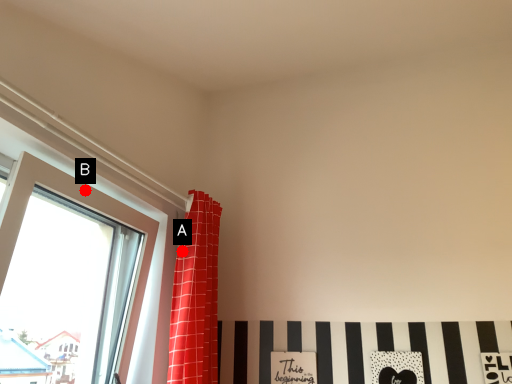
Question: Two points are circled on the image, labeled by A and B beside each circle. Which point is farther from the camera taking this photo?

Choices:
 (A) A is further
 (B) B is further

Answer: (A)